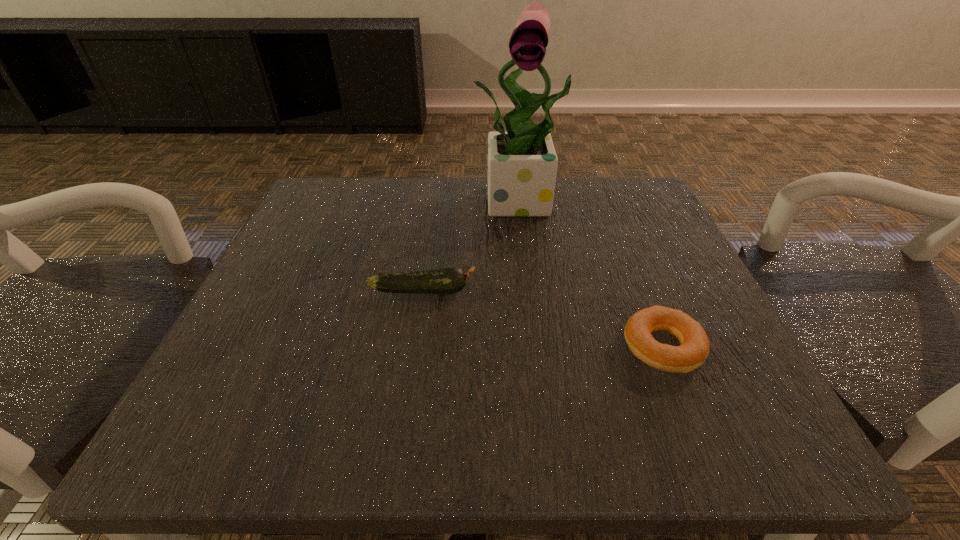
Where is `the tallest object`? the tallest object is located at coordinates tap(522, 163).

Identify the location of flower arrangement. This screenshot has height=540, width=960. (522, 163).

Image resolution: width=960 pixels, height=540 pixels. I want to click on the second nearest object, so click(x=450, y=279).

What are the coordinates of `the nearest object` in the screenshot? It's located at (694, 349).

Locate an element on the screen. The image size is (960, 540). bagel is located at coordinates [x=694, y=349].

Where is `vacant region located 0.360m on the front-facing side of the tallest object`? Image resolution: width=960 pixels, height=540 pixels. vacant region located 0.360m on the front-facing side of the tallest object is located at coordinates (549, 374).

Where is `free space located 0.290m at the blossom end of the second nearest object`? free space located 0.290m at the blossom end of the second nearest object is located at coordinates (649, 290).

The image size is (960, 540). Find the location of `free space located on the left of the nearest object`. free space located on the left of the nearest object is located at coordinates (561, 347).

This screenshot has height=540, width=960. What are the coordinates of `object positioned at the far edge` in the screenshot? It's located at (522, 163).

This screenshot has height=540, width=960. Find the location of `object present at the right edge`. object present at the right edge is located at coordinates (694, 349).